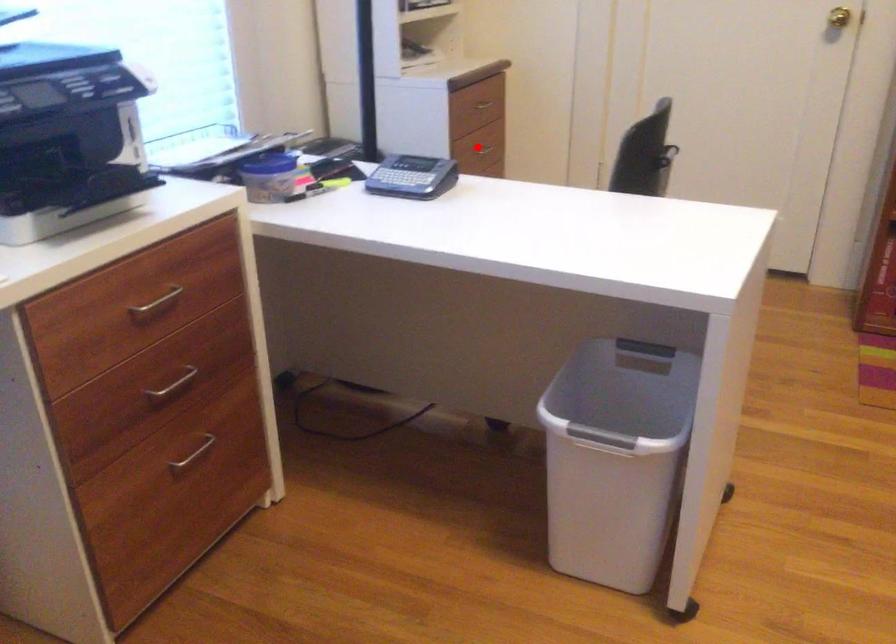
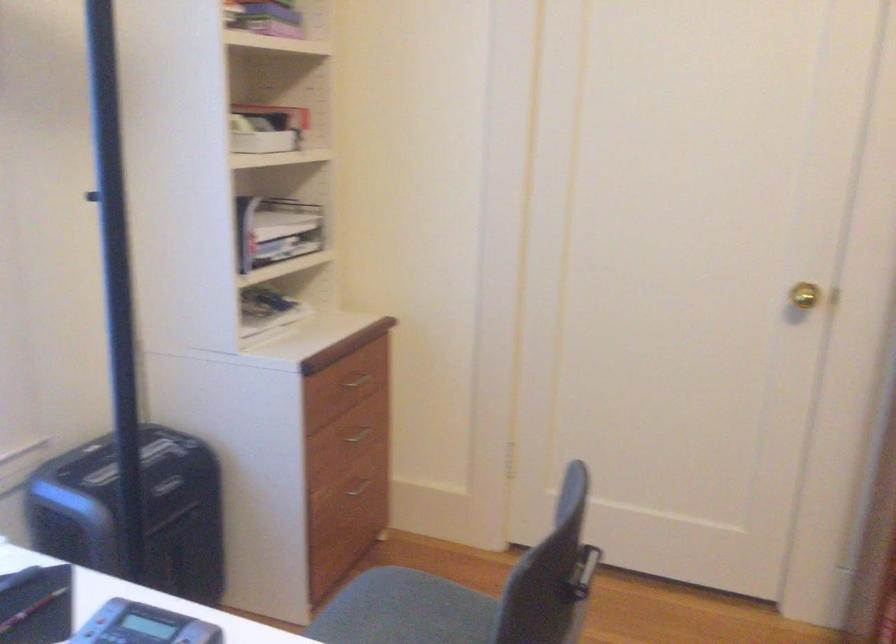
Question: I am providing you with two images of the same scene from different viewpoints. Given a red point in image1, look at the same physical point in image2. Is it:

Choices:
 (A) Closer to the viewpoint
 (B) Farther from the viewpoint

Answer: (A)